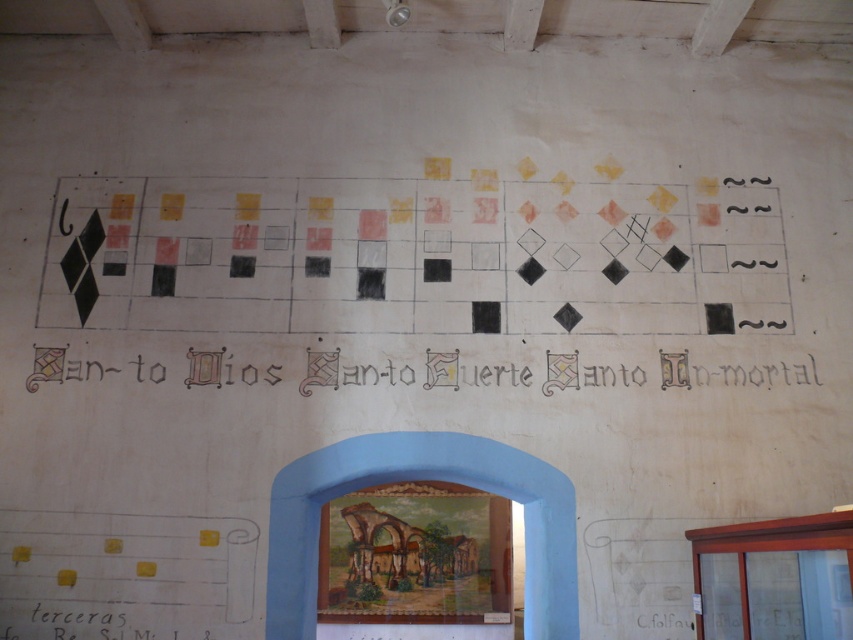
You are standing in the historical building and want to place a small decorative item on the wall. You have a choice between placing it near the blue painted archway at center or the black paper at lower left. Based on their positions, which location is closer to the right side of the wall?

The blue painted archway at center is to the right of the black paper at lower left, so placing the item near the blue painted archway at center would be closer to the right side of the wall.

You are an interior designer working on a historical building. You need to place a new decorative item on the wall. The item is 10 cm wide. The black calligraphy at center and the black paper at lower left are already present. Which object can the new item fit next to without overlapping?

The black paper at lower left has a smaller size compared to the black calligraphy at center, so the new 10 cm wide item can fit next to the black paper at lower left without overlapping.

You are standing in front of the wall with the grid design. There are two elements here, the blue painted archway at center and the black calligraphy at center. Which one is closer to you?

The blue painted archway at center is in front of the black calligraphy at center, so the blue painted archway at center is closer to you.